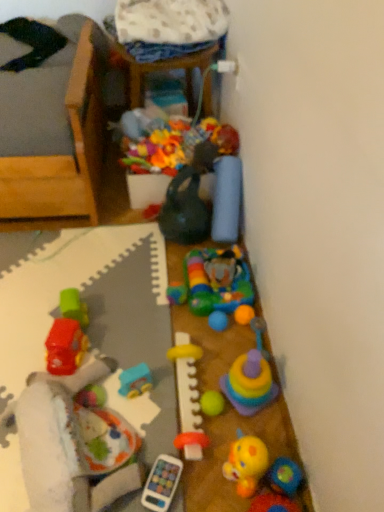
Image resolution: width=384 pixels, height=512 pixels. I want to click on free space between rubberized plastic baby rattle at lower left, arranged as the first toy when viewed from the left, and blue plastic toy car at center, which is the second toy from left to right, so click(x=155, y=412).